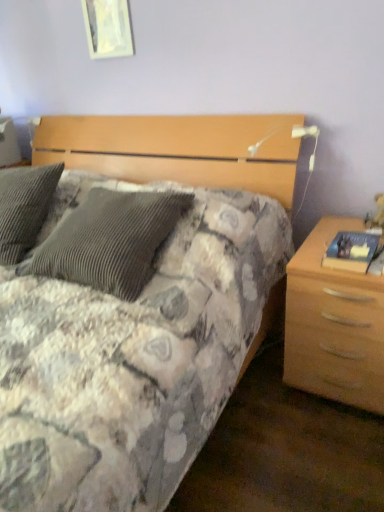
Locate an element on the screen. Image resolution: width=384 pixels, height=512 pixels. unoccupied area in front of light wood/texture nightstand at right is located at coordinates (329, 456).